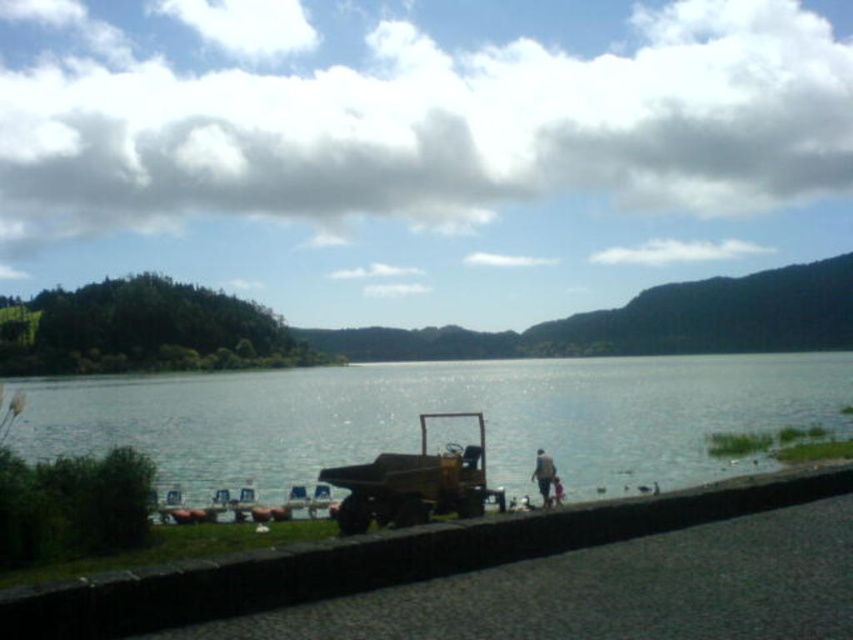
This screenshot has width=853, height=640. What do you see at coordinates (440, 410) in the screenshot? I see `clear water at lower center` at bounding box center [440, 410].

Image resolution: width=853 pixels, height=640 pixels. I want to click on clear water at lower center, so click(440, 410).

Between yellow matte truck at center and brown fabric jacket at lower center, which one appears on the left side from the viewer's perspective?

yellow matte truck at center is more to the left.

Which is above, yellow matte truck at center or brown fabric jacket at lower center?

yellow matte truck at center

Find the location of a particular element. yellow matte truck at center is located at coordinates (415, 484).

This screenshot has width=853, height=640. In order to click on yellow matte truck at center in this screenshot , I will do `click(415, 484)`.

Is the position of clear water at lower center more distant than that of brown fabric jacket at lower center?

No, clear water at lower center is closer to the viewer.

Who is lower down, clear water at lower center or brown fabric jacket at lower center?

clear water at lower center is below.

Who is more forward, (x=665, y=417) or (x=550, y=484)?

Point (x=550, y=484) is more forward.

Where is `clear water at lower center`? The height and width of the screenshot is (640, 853). clear water at lower center is located at coordinates (440, 410).